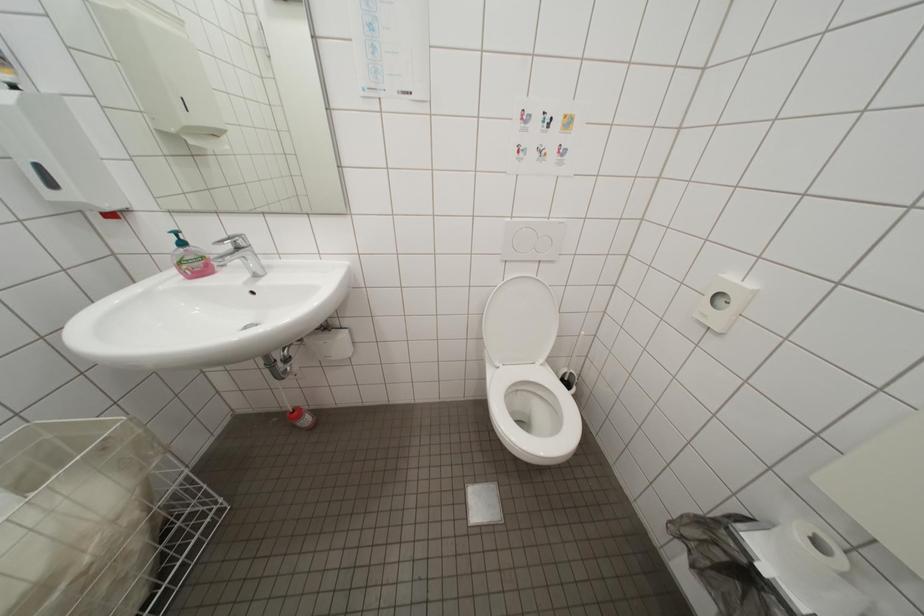
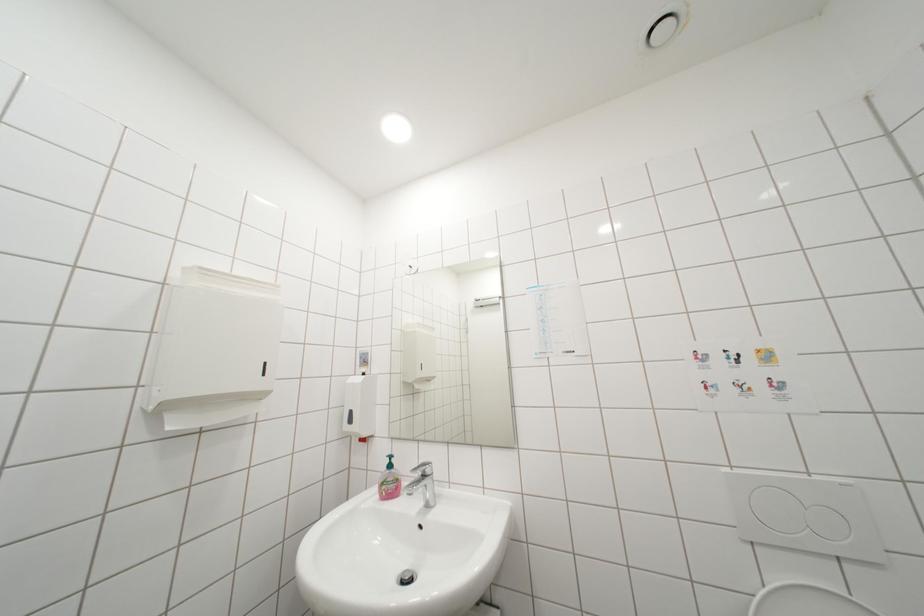
First-person continuous shooting, in which direction is the camera rotating?

The rotation direction of the camera is left-up.